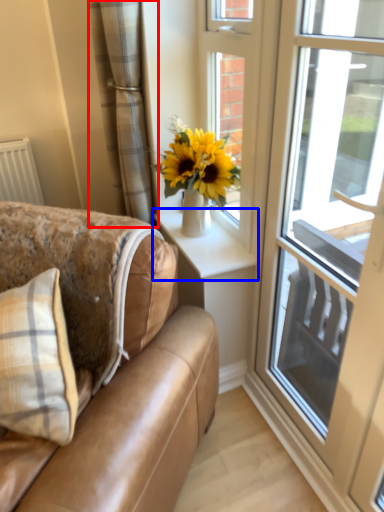
Question: Among these objects, which one is farthest to the camera, curtain (highlighted by a red box) or window sill (highlighted by a blue box)?

Choices:
 (A) curtain
 (B) window sill

Answer: (B)